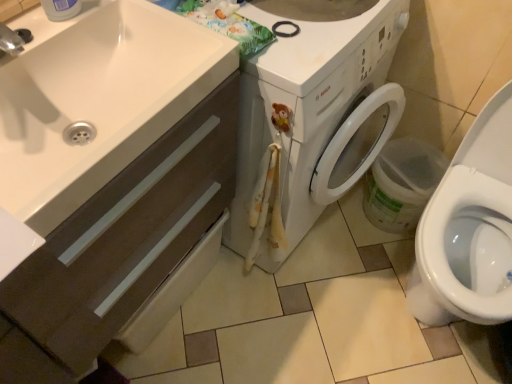
Question: In the image, is white glossy washing machine at center positioned in front of or behind white glossy toilet at lower right?

Choices:
 (A) behind
 (B) front

Answer: (A)

Question: Considering the relative positions of white glossy washing machine at center and white glossy toilet at lower right in the image provided, is white glossy washing machine at center to the left or to the right of white glossy toilet at lower right?

Choices:
 (A) right
 (B) left

Answer: (B)

Question: Estimate the real-world distances between objects in this image. Which object is farther from the white glossy sink at lower left?

Choices:
 (A) white glossy washing machine at center
 (B) matte brown cabinet at lower left
 (C) white glossy toilet at lower right

Answer: (C)

Question: Based on their relative distances, which object is nearer to the matte brown cabinet at lower left?

Choices:
 (A) white glossy toilet at lower right
 (B) white glossy washing machine at center
 (C) white glossy sink at lower left

Answer: (C)